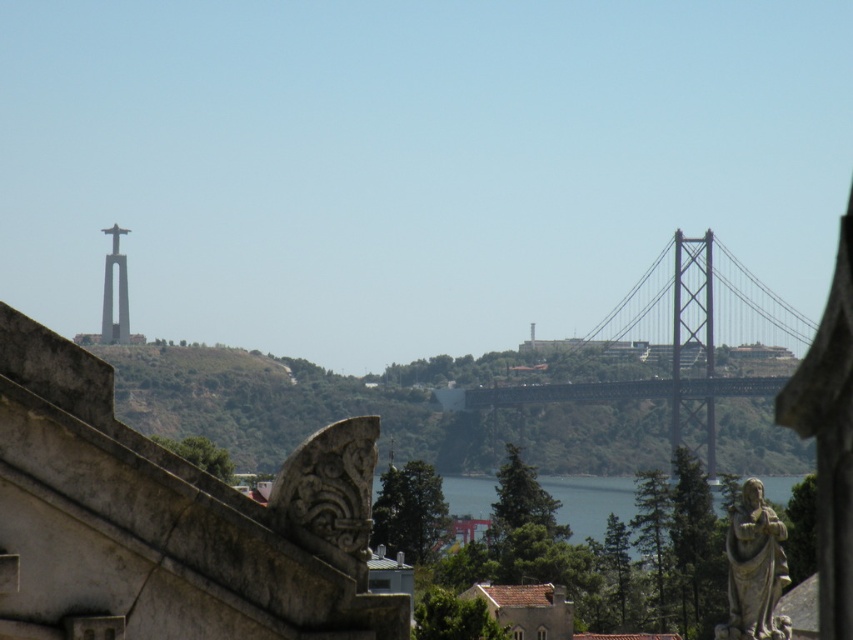
You are standing at the base of the stone statue at lower right and want to reach the blue water at center. Which direction should you move to get there?

You should move downward because the stone statue at lower right is located above the blue water at center, so going down will lead you towards the blue water at center.

You are standing at the stone structure in the foreground of the cityscape. You want to take a photo of the metallic bridge at center. Which direction should you face to capture it in your view?

The metallic bridge at center is located at coordinates 0.533 on the x axis and 0.802 on the y axis, so you should face towards the center area of the image to capture it in your view.

You are standing at the point with coordinates point (727,540) and want to walk towards the point with coordinates point (631,486). Given the cityscape described, will you have an unobstructed path? Please explain using the spatial relationship between the two points.

Since point (727,540) is in front of point (631,486), you will not have an unobstructed path because the closer point (727,540) blocks the way to the farther point (631,486).